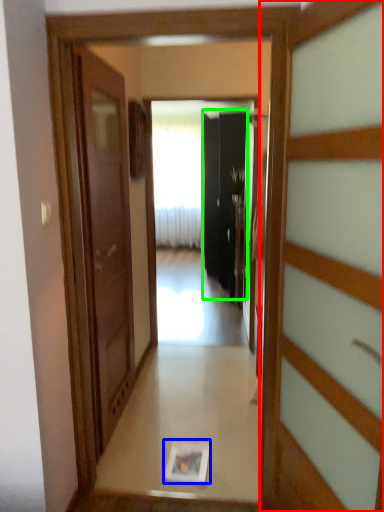
Question: Estimate the real-world distances between objects in this image. Which object is closer to door (highlighted by a red box), magazine (highlighted by a blue box) or screen door (highlighted by a green box)?

Choices:
 (A) magazine
 (B) screen door

Answer: (A)